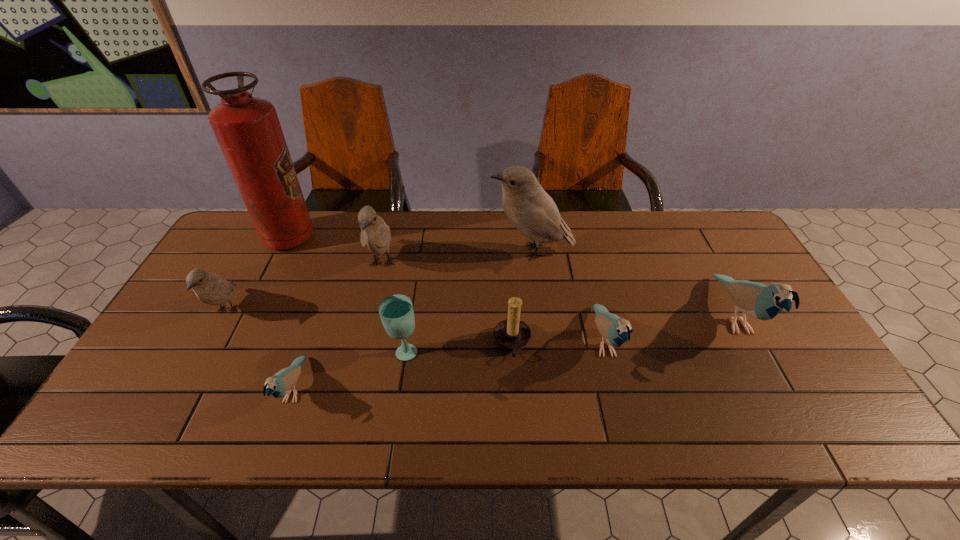
What are the coordinates of `vacant space located at the face of the rightmost object` in the screenshot? It's located at (794, 428).

The height and width of the screenshot is (540, 960). Find the location of `free space located at the beak of the smallest white bird`. free space located at the beak of the smallest white bird is located at coordinates (197, 366).

Locate an element on the screen. The width and height of the screenshot is (960, 540). vacant space located 0.070m at the face of the second blue bird from right to left is located at coordinates (621, 409).

Where is `vacant space located on the left of the fifth object from right to left`? vacant space located on the left of the fifth object from right to left is located at coordinates (345, 350).

Identify the location of vacant space located 0.370m on the wick of the brown candle holder. The height and width of the screenshot is (540, 960). pos(349,344).

This screenshot has height=540, width=960. I want to click on blank space located on the wick of the brown candle holder, so click(x=349, y=344).

The height and width of the screenshot is (540, 960). I want to click on free space located 0.380m on the wick of the brown candle holder, so click(346, 344).

Where is `fire extinguisher that is at the far edge`? fire extinguisher that is at the far edge is located at coordinates (248, 131).

Locate an element on the screen. The width and height of the screenshot is (960, 540). object at the near edge is located at coordinates (280, 384).

Where is `fire extinguisher that is at the left edge`? This screenshot has width=960, height=540. fire extinguisher that is at the left edge is located at coordinates (248, 131).